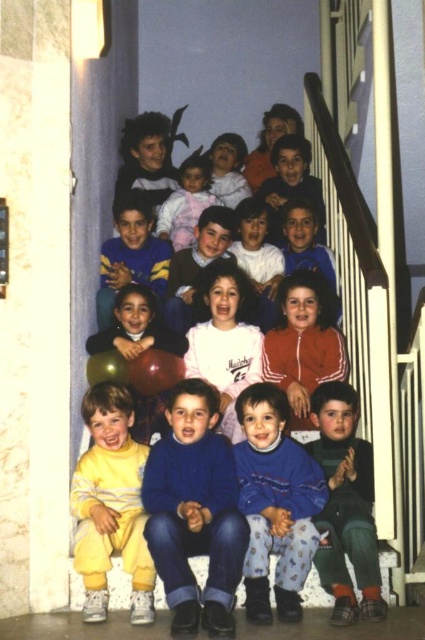
Which is more to the left, blue sweater at center or matte red jacket at center?

blue sweater at center is more to the left.

Locate an element on the screen. blue sweater at center is located at coordinates (195, 512).

Which is in front, point (161, 493) or point (258, 355)?

Positioned in front is point (161, 493).

Find the location of a particular element. blue sweater at center is located at coordinates (195, 512).

Measure the distance between point (184, 593) and camera.

Point (184, 593) is 3.38 meters away from camera.

Locate an element on the screen. The width and height of the screenshot is (425, 640). blue sweater at center is located at coordinates (195, 512).

Can you confirm if blue sweater at center is wider than light pink fleece at center?

Yes, blue sweater at center is wider than light pink fleece at center.

Which is more to the right, blue sweater at center or light pink fleece at center?

Positioned to the right is blue sweater at center.

Who is more distant from viewer, (175,404) or (209,196)?

The point (209,196) is behind.

Image resolution: width=425 pixels, height=640 pixels. I want to click on blue sweater at center, so click(195, 512).